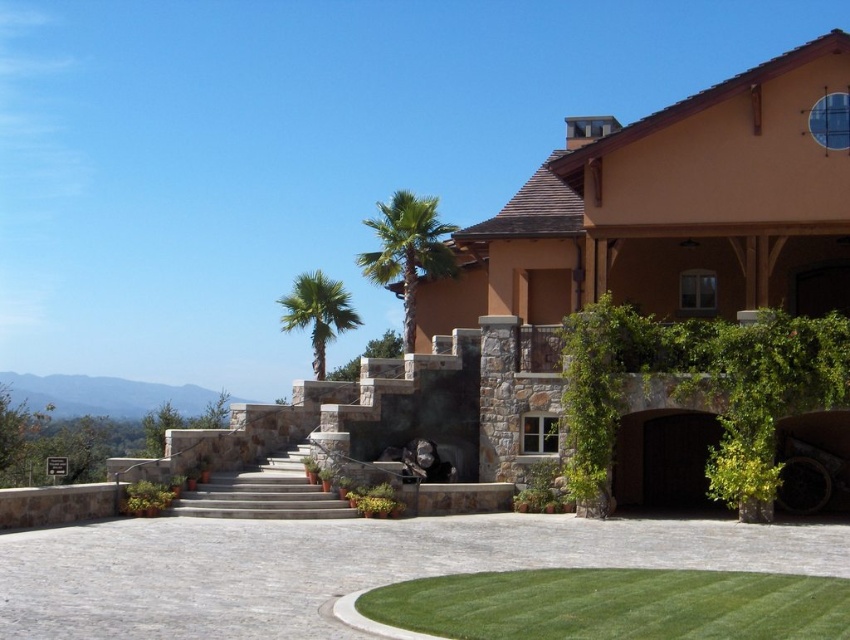
You are standing at the entrance of the property and want to walk towards the house. Which direction should you head to reach the gray cobblestone driveway at center?

Since the gray cobblestone driveway at center is located at coordinates point (337,566), you should head towards the center of the image to reach it.

You are standing at the entrance of the property and want to walk to the house. The gray cobblestone driveway at center and the gray stone stairs at center are both in your path. How far apart are these two features from each other?

The gray cobblestone driveway at center is 23.71 feet away from the gray stone stairs at center.

You are a landscape architect designing a pathway for the property. You need to place a decorative fountain between the gray stone stairs at center and the green leafy palm tree at center. Which object should the fountain be closer to if it must be placed closer to the smaller one?

The fountain should be placed closer to the gray stone stairs at center because it is smaller than the green leafy palm tree at center.